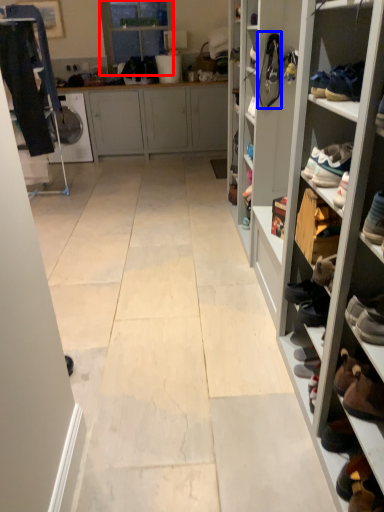
Question: Which object is closer to the camera taking this photo, glass door (highlighted by a red box) or shoe (highlighted by a blue box)?

Choices:
 (A) glass door
 (B) shoe

Answer: (B)